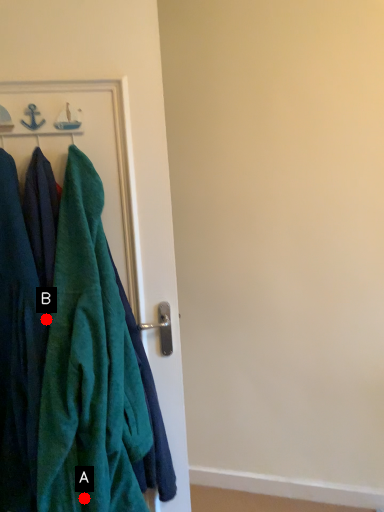
Question: Two points are circled on the image, labeled by A and B beside each circle. Which of the following is the farthest from the observer?

Choices:
 (A) A is further
 (B) B is further

Answer: (B)